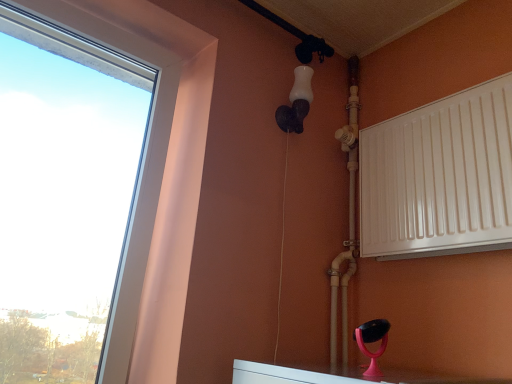
Question: Can you confirm if white matte light fixture at upper center is positioned to the right of white glossy pipe at upper right?

Choices:
 (A) yes
 (B) no

Answer: (B)

Question: From a real-world perspective, does white matte light fixture at upper center stand above white glossy pipe at upper right?

Choices:
 (A) no
 (B) yes

Answer: (B)

Question: Is white matte light fixture at upper center taller than white glossy pipe at upper right?

Choices:
 (A) no
 (B) yes

Answer: (A)

Question: From a real-world perspective, is white matte light fixture at upper center located beneath white glossy pipe at upper right?

Choices:
 (A) no
 (B) yes

Answer: (A)

Question: Is white matte light fixture at upper center further to camera compared to white glossy pipe at upper right?

Choices:
 (A) no
 (B) yes

Answer: (B)

Question: Based on their sizes in the image, would you say white plastic window at left is bigger or smaller than white glossy pipe at upper right?

Choices:
 (A) big
 (B) small

Answer: (A)

Question: Looking at their shapes, would you say white plastic window at left is wider or thinner than white glossy pipe at upper right?

Choices:
 (A) thin
 (B) wide

Answer: (B)

Question: Does point (151, 11) appear closer or farther from the camera than point (344, 142)?

Choices:
 (A) closer
 (B) farther

Answer: (A)

Question: Would you say white plastic window at left is inside or outside white glossy pipe at upper right?

Choices:
 (A) outside
 (B) inside

Answer: (A)

Question: In the image, is white matte radiator at right positioned in front of or behind white plastic window at left?

Choices:
 (A) front
 (B) behind

Answer: (B)

Question: From the image's perspective, is white matte radiator at right located above or below white plastic window at left?

Choices:
 (A) below
 (B) above

Answer: (A)

Question: Considering the positions of white matte radiator at right and white plastic window at left in the image, is white matte radiator at right taller or shorter than white plastic window at left?

Choices:
 (A) short
 (B) tall

Answer: (A)

Question: Considering the positions of white matte radiator at right and white plastic window at left in the image, is white matte radiator at right bigger or smaller than white plastic window at left?

Choices:
 (A) small
 (B) big

Answer: (A)

Question: Is point (135, 23) closer or farther from the camera than point (415, 119)?

Choices:
 (A) closer
 (B) farther

Answer: (A)

Question: Would you say white plastic window at left is inside or outside white matte radiator at right?

Choices:
 (A) inside
 (B) outside

Answer: (B)